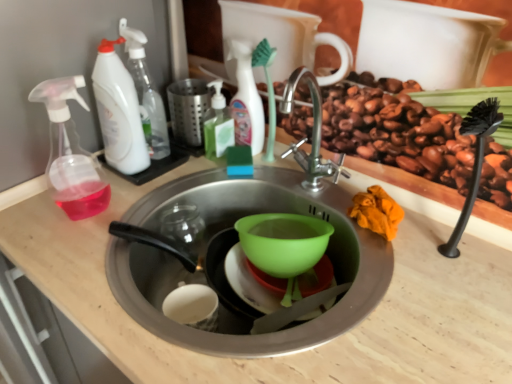
The width and height of the screenshot is (512, 384). What are the coordinates of `free area behind transparent plastic spray bottle at left` in the screenshot? It's located at (134, 176).